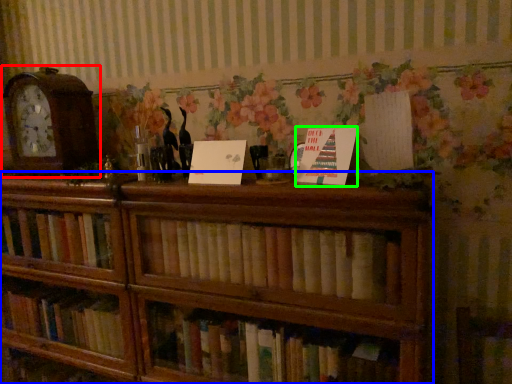
Question: Considering the real-world distances, which object is farthest from alarm clock (highlighted by a red box)? bookcase (highlighted by a blue box) or paperback book (highlighted by a green box)?

Choices:
 (A) bookcase
 (B) paperback book

Answer: (B)